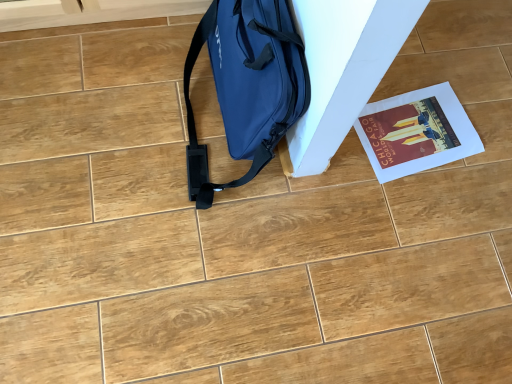
Question: Should I look upward or downward to see matte blue bag at center-left?

Choices:
 (A) up
 (B) down

Answer: (A)

Question: From the image's perspective, is matte paper poster at lower right below matte blue bag at center-left?

Choices:
 (A) yes
 (B) no

Answer: (A)

Question: Can you confirm if matte paper poster at lower right is smaller than matte blue bag at center-left?

Choices:
 (A) yes
 (B) no

Answer: (A)

Question: Considering the relative sizes of matte paper poster at lower right and matte blue bag at center-left in the image provided, is matte paper poster at lower right thinner than matte blue bag at center-left?

Choices:
 (A) yes
 (B) no

Answer: (B)

Question: Is matte paper poster at lower right outside of matte blue bag at center-left?

Choices:
 (A) no
 (B) yes

Answer: (B)

Question: Considering the relative sizes of matte paper poster at lower right and matte blue bag at center-left in the image provided, is matte paper poster at lower right wider than matte blue bag at center-left?

Choices:
 (A) no
 (B) yes

Answer: (B)

Question: Is matte paper poster at lower right in front of matte blue bag at center-left?

Choices:
 (A) yes
 (B) no

Answer: (B)

Question: From the image's perspective, is matte blue bag at center-left under matte paper poster at lower right?

Choices:
 (A) yes
 (B) no

Answer: (B)

Question: From a real-world perspective, is matte blue bag at center-left located beneath matte paper poster at lower right?

Choices:
 (A) yes
 (B) no

Answer: (B)

Question: Does matte blue bag at center-left have a greater width compared to matte paper poster at lower right?

Choices:
 (A) no
 (B) yes

Answer: (A)

Question: Can you confirm if matte blue bag at center-left is bigger than matte paper poster at lower right?

Choices:
 (A) yes
 (B) no

Answer: (A)

Question: Would you say matte blue bag at center-left is outside matte paper poster at lower right?

Choices:
 (A) yes
 (B) no

Answer: (A)

Question: From the image's perspective, is matte blue bag at center-left on matte paper poster at lower right?

Choices:
 (A) no
 (B) yes

Answer: (B)

Question: Does point 458,125 appear closer or farther from the camera than point 276,46?

Choices:
 (A) closer
 (B) farther

Answer: (B)